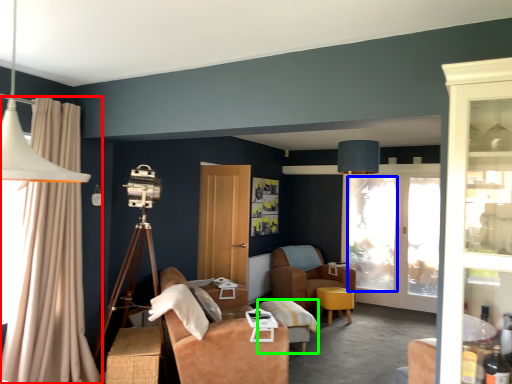
Question: Based on their relative distances, which object is farther from curtain (highlighted by a red box)? Choose from window screen (highlighted by a blue box) and table (highlighted by a green box).

Choices:
 (A) window screen
 (B) table

Answer: (A)